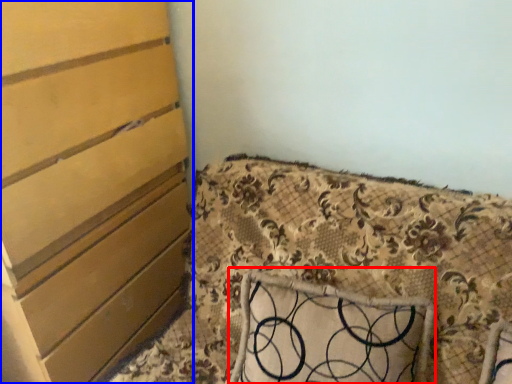
Question: Which object appears closest to the camera in this image, pillow (highlighted by a red box) or chest of drawers (highlighted by a blue box)?

Choices:
 (A) pillow
 (B) chest of drawers

Answer: (B)